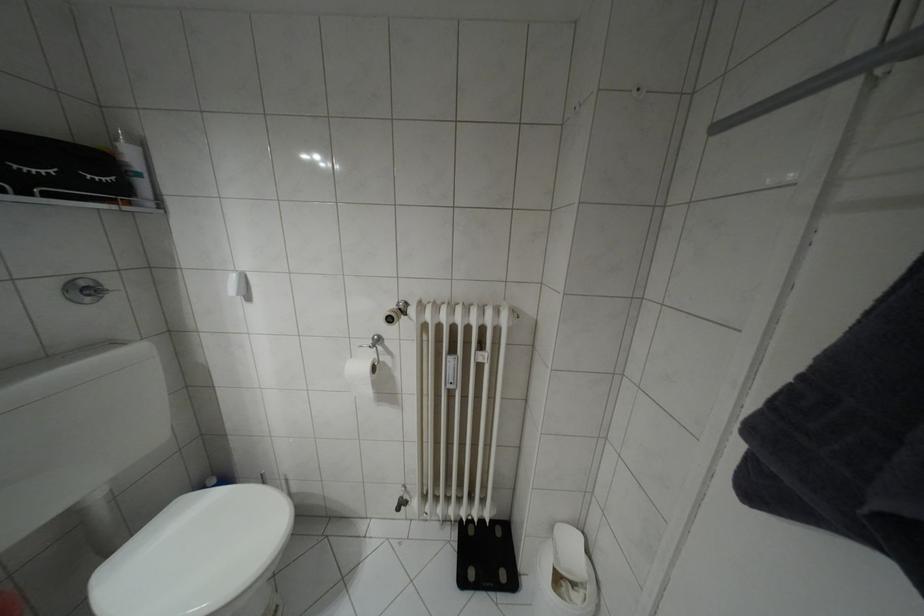
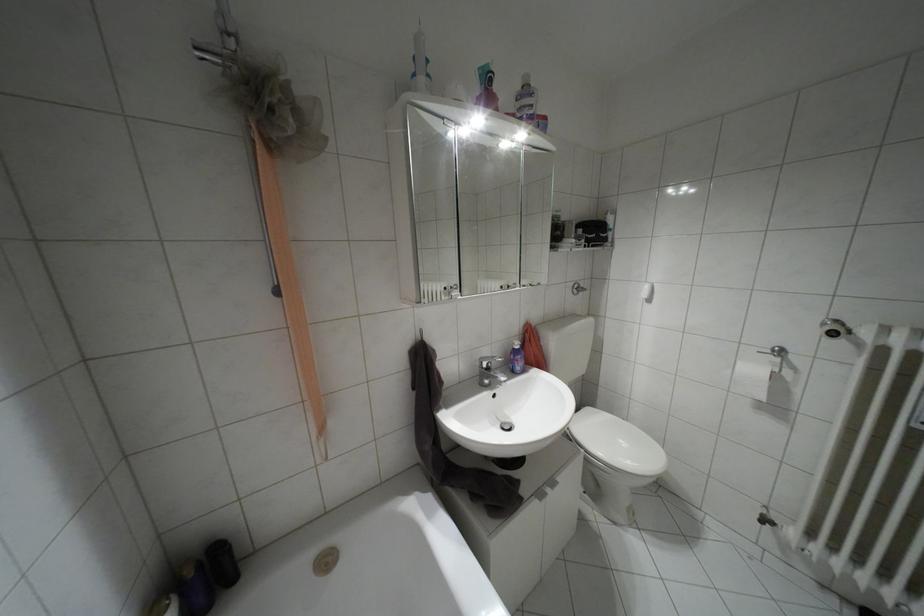
Question: Based on the continuous images, in which direction is the camera rotating? Reply with the corresponding letter.

Choices:
 (A) Left
 (B) Right
 (C) Up
 (D) Down

Answer: (A)